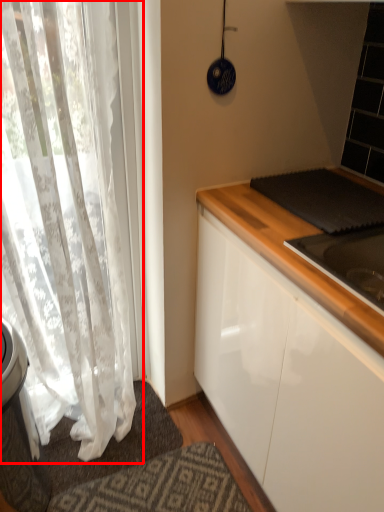
Question: In this image, where is curtain (annotated by the red box) located relative to doormat?

Choices:
 (A) right
 (B) left

Answer: (B)